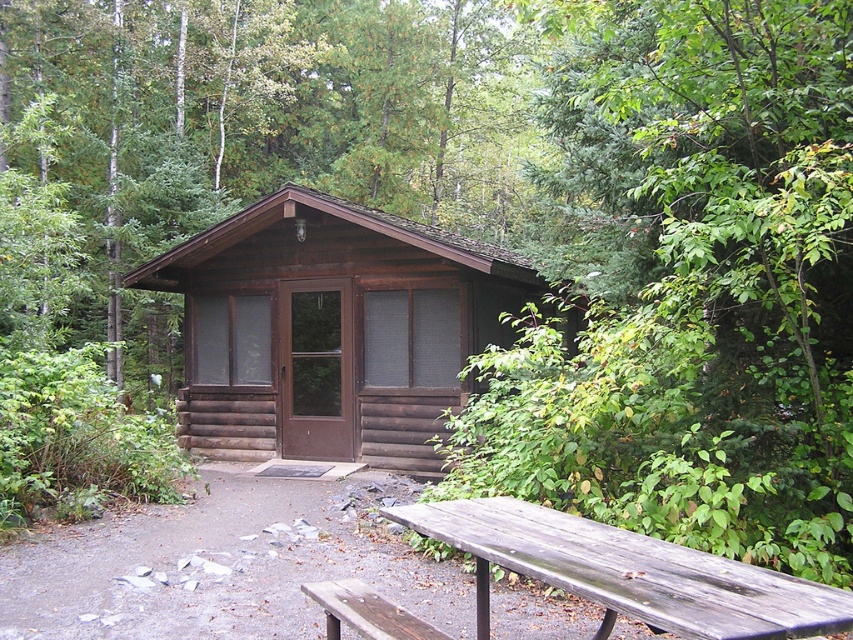
Which is above, brown log cabin at center or weathered wood picnic table at lower center?

brown log cabin at center is above.

Is brown log cabin at center above weathered wood picnic table at lower center?

Indeed, brown log cabin at center is positioned over weathered wood picnic table at lower center.

Is point (392, 433) in front of point (634, 540)?

No, (392, 433) is behind (634, 540).

You are a GUI agent. You are given a task and a screenshot of the screen. Output one action in this format:
    pyautogui.click(x=<x>, y=<y>)
    Task: Click on the brown log cabin at center
    The image size is (853, 640).
    Given the screenshot: What is the action you would take?
    pyautogui.click(x=331, y=330)